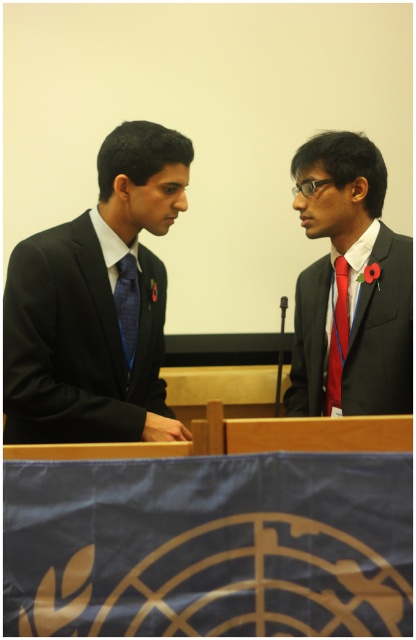
You are a photographer at a formal event. You need to capture a photo of the matte black suit at left and the blue satin tie at left. Based on their positions, can you tell which one is higher in the image?

The matte black suit at left is located above the blue satin tie at left, so the matte black suit at left is higher in the image.

You are standing at the podium and want to place a name tag at point (15, 330) which is in front of point (114, 301). Which point is closer to the audience?

Point (15, 330) is in front of point (114, 301), so it is closer to the audience.

You are standing at the origin point of a coordinate system where the bottom left corner of the image is the origin. You need to locate the matte black suit at center. What are its coordinates?

The coordinates of the matte black suit at center are at point [349,285].